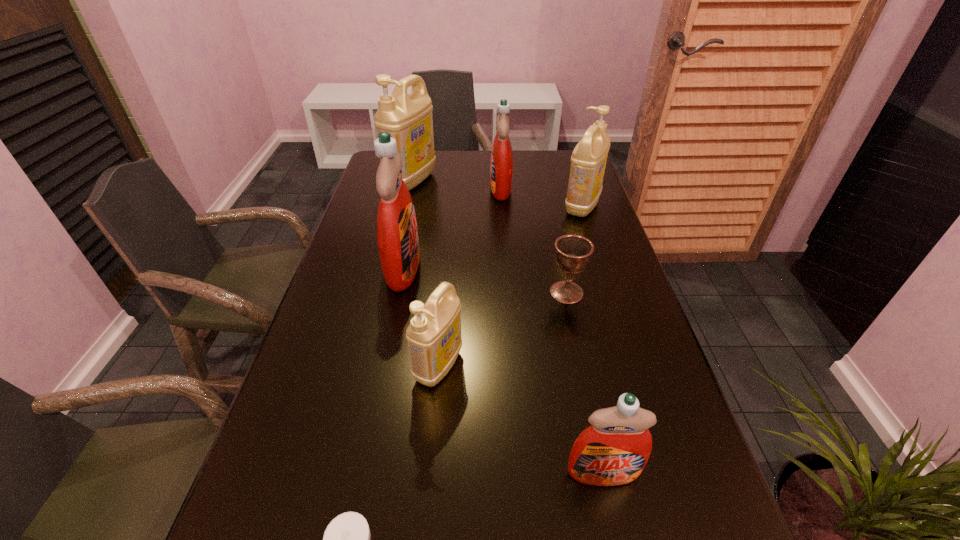
I want to click on object that is at the far left corner, so click(x=408, y=118).

Locate an element on the screen. Image resolution: width=960 pixels, height=540 pixels. free region at the far edge of the desktop is located at coordinates (476, 171).

The width and height of the screenshot is (960, 540). What are the coordinates of `vacant space at the left edge of the desktop` in the screenshot? It's located at (373, 181).

This screenshot has width=960, height=540. I want to click on vacant space at the right edge of the desktop, so click(616, 283).

This screenshot has width=960, height=540. Identify the location of free region at the far right corner. (550, 158).

You are a GUI agent. You are given a task and a screenshot of the screen. Output one action in this format:
    pyautogui.click(x=<x>, y=<y>)
    Task: Click on the free point between the chalice and the second biggest red detergent
    The width and height of the screenshot is (960, 540).
    Given the screenshot: What is the action you would take?
    pyautogui.click(x=534, y=241)

I want to click on vacant area between the rightmost beige detergent and the leftmost red detergent, so click(x=492, y=237).

What are the coordinates of `blank region between the biggest beige detergent and the third detergent from right to left` in the screenshot? It's located at (456, 185).

At what (x,y) coordinates should I click in order to perform the action: click on free area in between the fifth farthest detergent and the nearest red detergent. Please return your answer as a coordinate pair (x, y). Looking at the image, I should click on (521, 420).

Where is `object that is the third closest to the fifth object from left to right`? This screenshot has height=540, width=960. object that is the third closest to the fifth object from left to right is located at coordinates (397, 234).